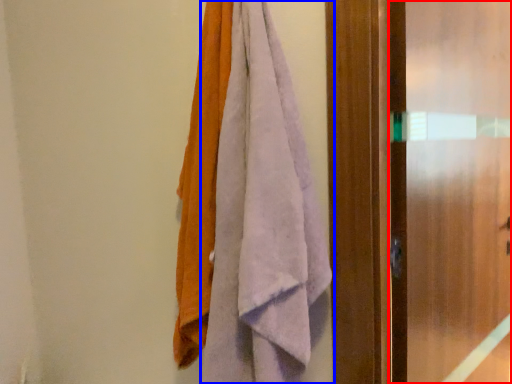
Question: Which of the following is the farthest to the observer, screen door (highlighted by a red box) or towel (highlighted by a blue box)?

Choices:
 (A) screen door
 (B) towel

Answer: (A)